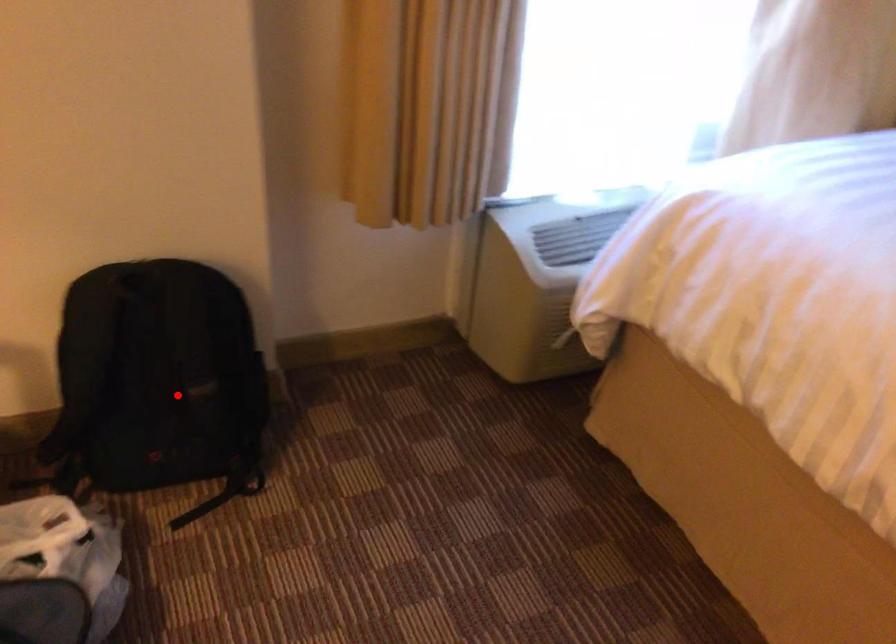
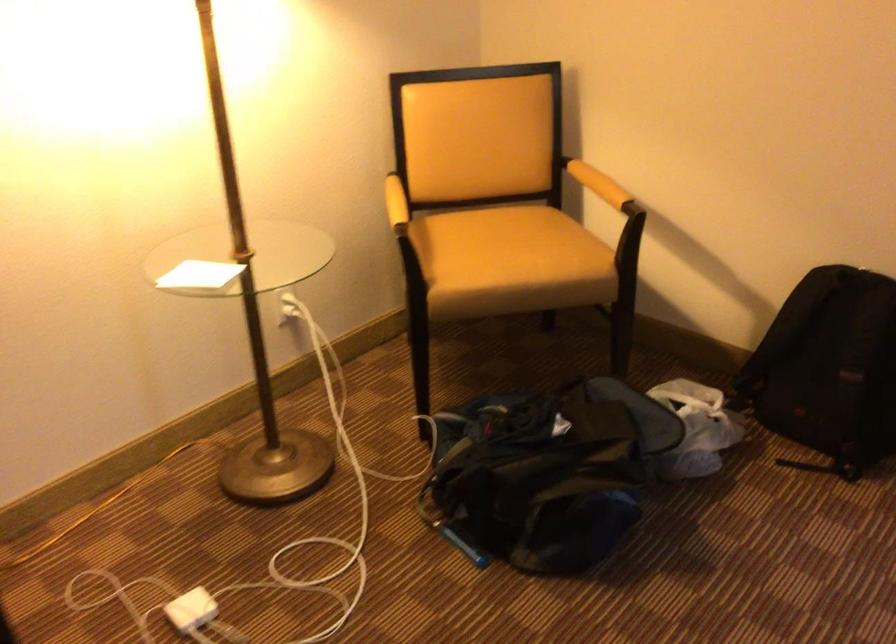
In the second image, find the point that corresponds to the highlighted location in the first image.

(829, 368)